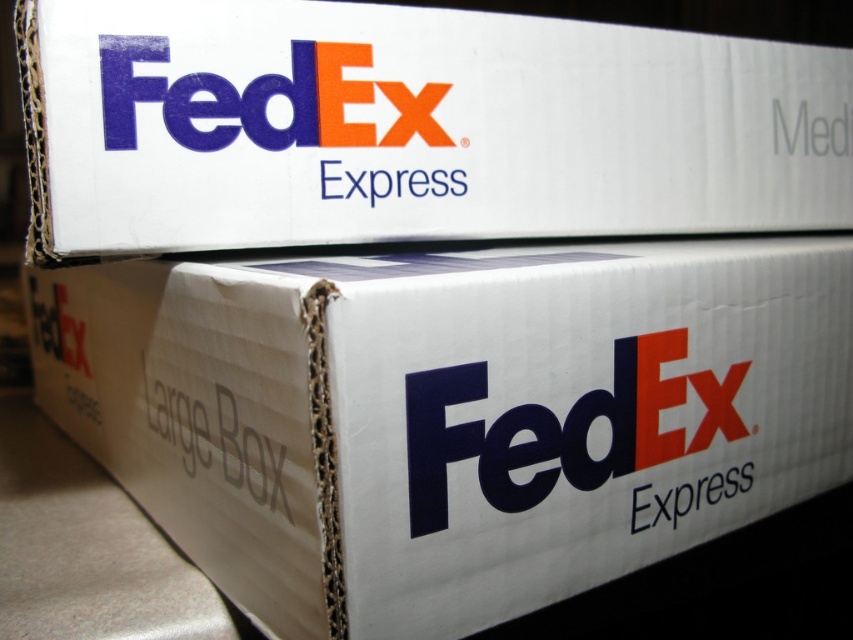
You are a delivery person trying to read the shipping labels on two FedEx boxes stacked vertically. The bottom box has the matte cardboard fedex express logo at center, and the top box has the white matte express at center. Which logo can you see more clearly?

The matte cardboard fedex express logo at center is closer to the viewer than the white matte express at center, so you can see it more clearly.

You are a delivery person trying to read the text on the boxes. The white cardboard box at upper center has the FedEx logo, and the white matte express at center has the word Express. How far apart are these two texts from each other?

The white cardboard box at upper center is 13.90 inches away from the white matte express at center.